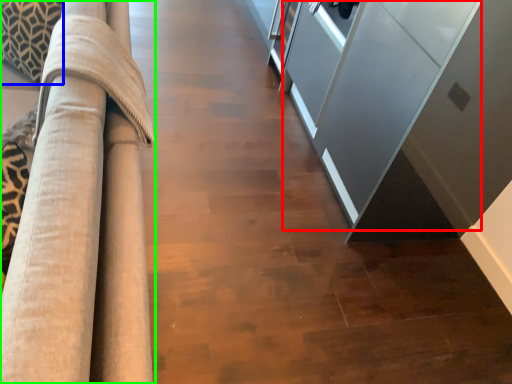
Question: Which object is positioned closest to glass door (highlighted by a red box)? Select from pillow (highlighted by a blue box) and furniture (highlighted by a green box).

Choices:
 (A) pillow
 (B) furniture

Answer: (B)